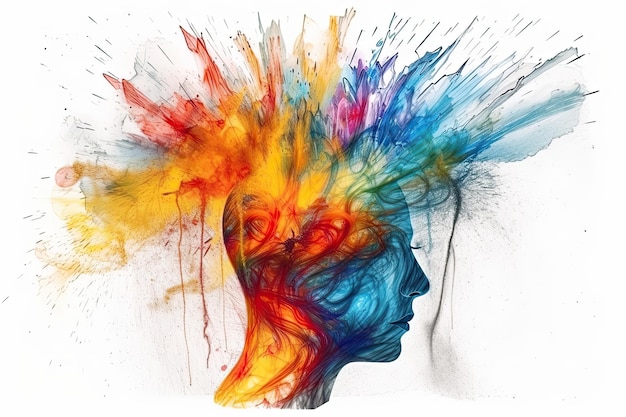
At what (x,y) coordinates should I click in order to perform the action: click on purple paint. Please return your answer as a coordinate pair (x, y). The image size is (626, 417). Looking at the image, I should click on point(382,73), point(385,105), point(365,90).